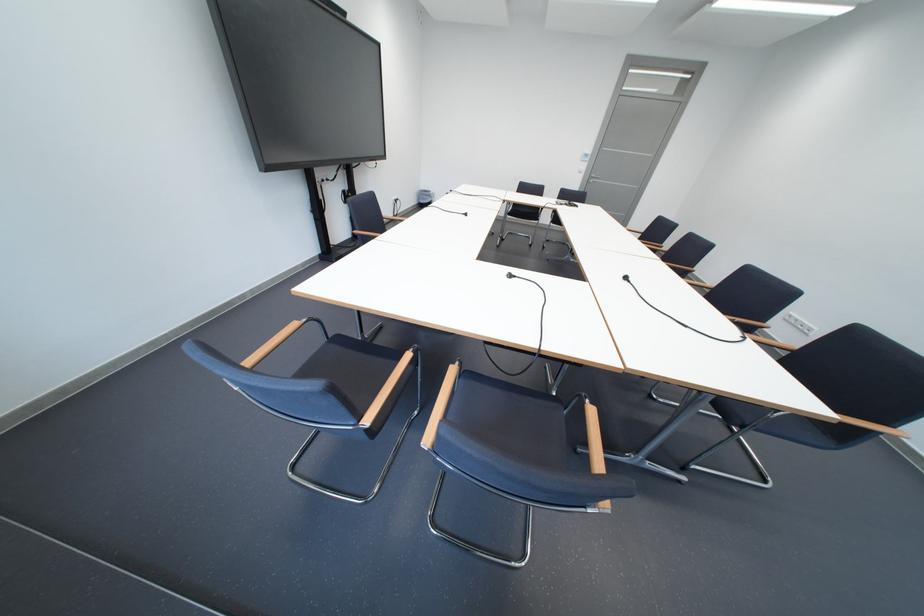
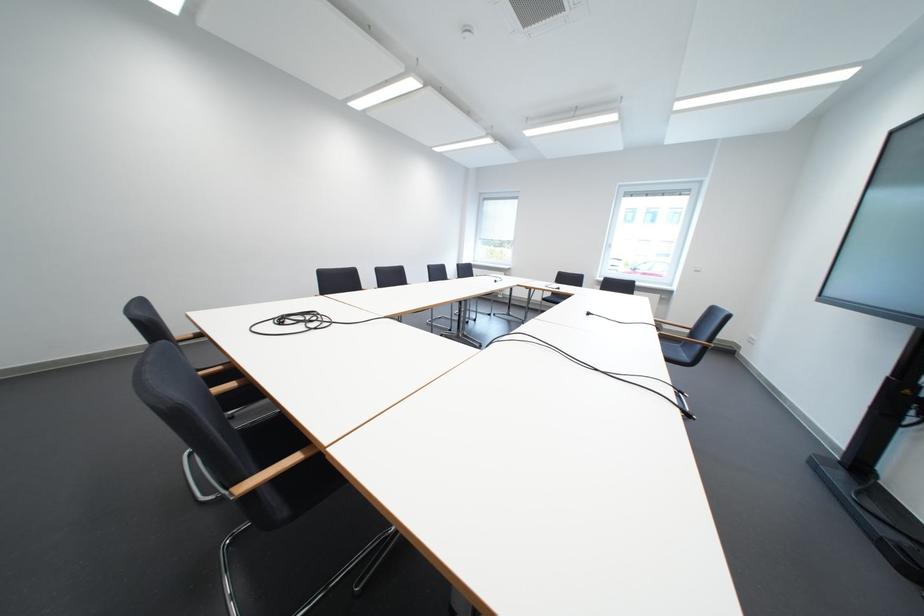
The point at (479, 216) is marked in the first image. Where is the corresponding point in the second image?

(601, 315)